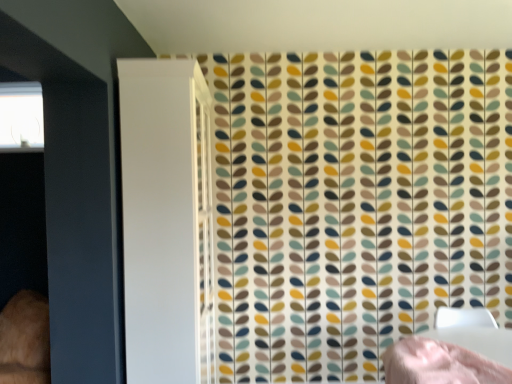
Locate an element on the screen. This screenshot has height=384, width=512. transparent glass window at upper left is located at coordinates (21, 116).

Do you think transparent glass window at upper left is within white glossy screen door at left, or outside of it?

transparent glass window at upper left lies outside white glossy screen door at left.

From the image's perspective, is transparent glass window at upper left beneath white glossy screen door at left?

Incorrect, from the image's perspective, transparent glass window at upper left is higher than white glossy screen door at left.

From a real-world perspective, which object rests below the other?

white glossy screen door at left is physically lower.

Locate an element on the screen. The image size is (512, 384). window on the left of white glossy screen door at left is located at coordinates (21, 116).

Between pink fabric bed at lower right and white glossy screen door at left, which one is positioned behind?

white glossy screen door at left.

Can you tell me how much pink fabric bed at lower right and white glossy screen door at left differ in facing direction?

There is a 91.1-degree angle between the facing directions of pink fabric bed at lower right and white glossy screen door at left.

Between point (392, 370) and point (128, 71), which one is positioned in front?

The point (392, 370) is in front.

Between pink fabric bed at lower right and white glossy screen door at left, which one appears on the left side from the viewer's perspective?

white glossy screen door at left.

From the image's perspective, which is below, white glossy screen door at left or pink fabric bed at lower right?

pink fabric bed at lower right appears lower in the image.

Consider the image. Can you confirm if white glossy screen door at left is shorter than pink fabric bed at lower right?

No.

Does point (178, 338) come behind point (451, 380)?

Yes.

Is white glossy screen door at left next to pink fabric bed at lower right?

No, white glossy screen door at left is not with pink fabric bed at lower right.

From the picture: Could you tell me if pink fabric bed at lower right is turned towards transparent glass window at upper left?

No, pink fabric bed at lower right does not turn towards transparent glass window at upper left.

In terms of width, does pink fabric bed at lower right look wider or thinner when compared to transparent glass window at upper left?

Clearly, pink fabric bed at lower right has more width compared to transparent glass window at upper left.

Based on the photo, which is farther, (506, 376) or (11, 143)?

The point (11, 143) is farther from the camera.

Is transparent glass window at upper left to the right of pink fabric bed at lower right from the viewer's perspective?

In fact, transparent glass window at upper left is to the left of pink fabric bed at lower right.

From the image's perspective, between transparent glass window at upper left and pink fabric bed at lower right, which one is located above?

transparent glass window at upper left.

Does transparent glass window at upper left have a larger size compared to pink fabric bed at lower right?

No, transparent glass window at upper left is not bigger than pink fabric bed at lower right.

Based on the photo, from a real-world perspective, which is physically below, transparent glass window at upper left or pink fabric bed at lower right?

pink fabric bed at lower right is physically lower.

From the image's perspective, is white glossy screen door at left above or below transparent glass window at upper left?

white glossy screen door at left is situated lower than transparent glass window at upper left in the image.

Which point is more distant from viewer, (122, 205) or (32, 133)?

→ The point (32, 133) is more distant.

In order to click on window behind the white glossy screen door at left in this screenshot , I will do `click(21, 116)`.

Locate an element on the screen. screen door on the right of transparent glass window at upper left is located at coordinates (166, 220).

Identify the location of screen door located behind the pink fabric bed at lower right. (166, 220).

In the scene shown: When comparing their distances from pink fabric bed at lower right, does transparent glass window at upper left or white glossy screen door at left seem closer?

The object closer to pink fabric bed at lower right is white glossy screen door at left.

Which object lies further to the anchor point transparent glass window at upper left, white glossy screen door at left or pink fabric bed at lower right?

pink fabric bed at lower right is positioned further to the anchor transparent glass window at upper left.

Based on their spatial positions, is transparent glass window at upper left or pink fabric bed at lower right further from white glossy screen door at left?

transparent glass window at upper left is positioned further to the anchor white glossy screen door at left.

Based on their spatial positions, is pink fabric bed at lower right or transparent glass window at upper left closer to white glossy screen door at left?

pink fabric bed at lower right.

Estimate the real-world distances between objects in this image. Which object is closer to transparent glass window at upper left, pink fabric bed at lower right or white glossy screen door at left?

white glossy screen door at left.

When comparing their distances from pink fabric bed at lower right, does white glossy screen door at left or transparent glass window at upper left seem further?

transparent glass window at upper left is positioned further to the anchor pink fabric bed at lower right.

I want to click on screen door situated between transparent glass window at upper left and pink fabric bed at lower right from left to right, so click(x=166, y=220).